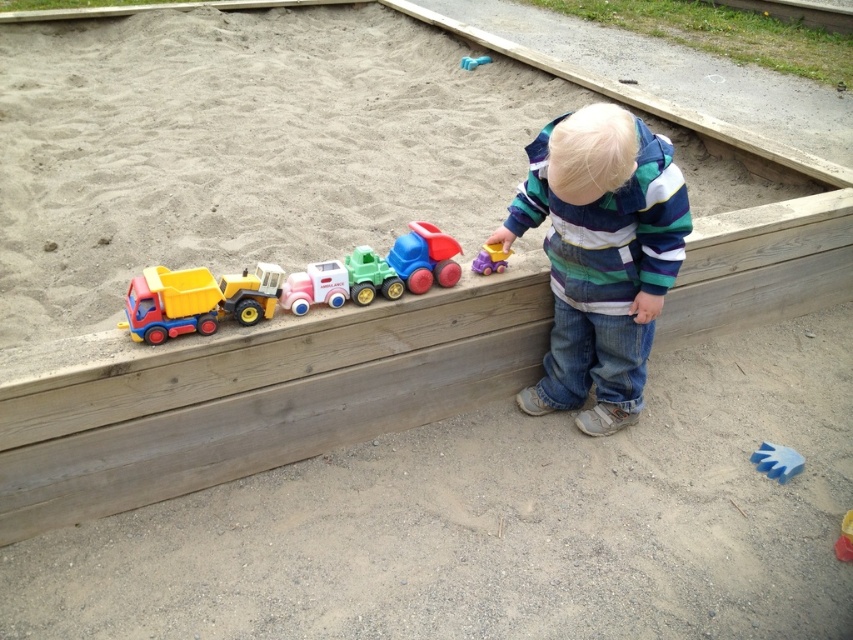
Which is in front, point (302, 129) or point (471, 268)?

Point (471, 268)

Between point (80, 173) and point (492, 244), which one is positioned in front?

Point (492, 244) is more forward.

Locate an element on the screen. smooth sand at upper left is located at coordinates (231, 144).

Which is more to the left, green plastic truck at center or blue rubber glove at lower right?

From the viewer's perspective, green plastic truck at center appears more on the left side.

Is green plastic truck at center positioned behind blue rubber glove at lower right?

No, it is in front of blue rubber glove at lower right.

Identify the location of green plastic truck at center. The image size is (853, 640). 370,276.

Is yellow plastic toy at upper center to the left of blue rubber glove at lower right from the viewer's perspective?

Incorrect, yellow plastic toy at upper center is not on the left side of blue rubber glove at lower right.

Can you confirm if yellow plastic toy at upper center is taller than blue rubber glove at lower right?

No, yellow plastic toy at upper center is not taller than blue rubber glove at lower right.

Is point (834, 550) farther from viewer compared to point (469, 68)?

No, it is not.

Locate an element on the screen. yellow plastic toy at upper center is located at coordinates (844, 538).